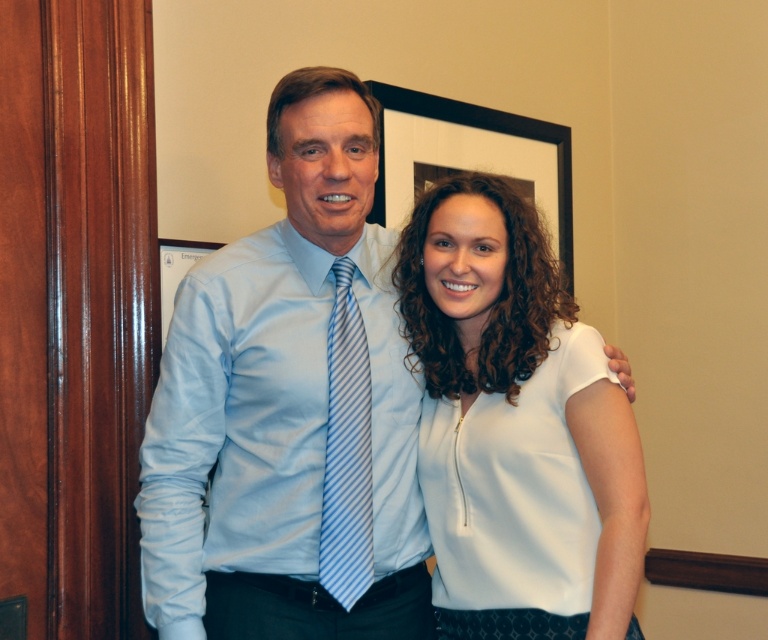
You are standing in the same room as the two people in the image. You want to move from your current position to the point marked by point (369,477). However, there is an obstacle at point (177,252). Will you encounter the obstacle before reaching your destination?

Since point (369,477) is in front of point (177,252), you will reach the destination before encountering the obstacle at point (177,252).

You are organizing a charity event and need to decide which item to display first between the light blue satin dress shirt at center and the blue striped tie at center. Based on their sizes, which one should you choose?

The light blue satin dress shirt at center has a larger size compared to the blue striped tie at center, so you should choose the light blue satin dress shirt at center to display first since it is bigger.